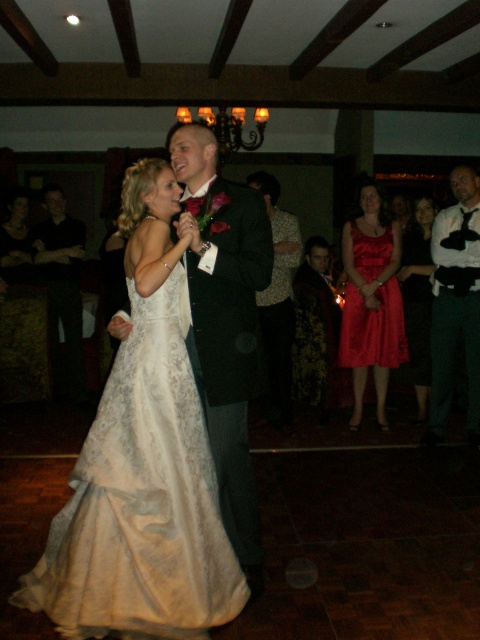
You are a photographer at the wedding reception. You need to capture a photo of both the dark green textured suit at right and the black smooth suit at left. Can you see both suits clearly in the frame?

The dark green textured suit at right is in front of the black smooth suit at left, so you might not be able to see the black smooth suit at left clearly if they are too close together.

You are a photographer at the wedding reception. You need to capture a group photo of the dark green textured suit at right and the black smooth suit at left. Which of the two suits will appear larger in the photo?

The black smooth suit at left will appear larger in the photo because it is bigger than the dark green textured suit at right.

In the wedding reception scene with wooden beams and a chandelier, there is a point marked at coordinates (456,305). What object is located at this specific coordinate?

The dark green textured suit at right is located at point (456,305).